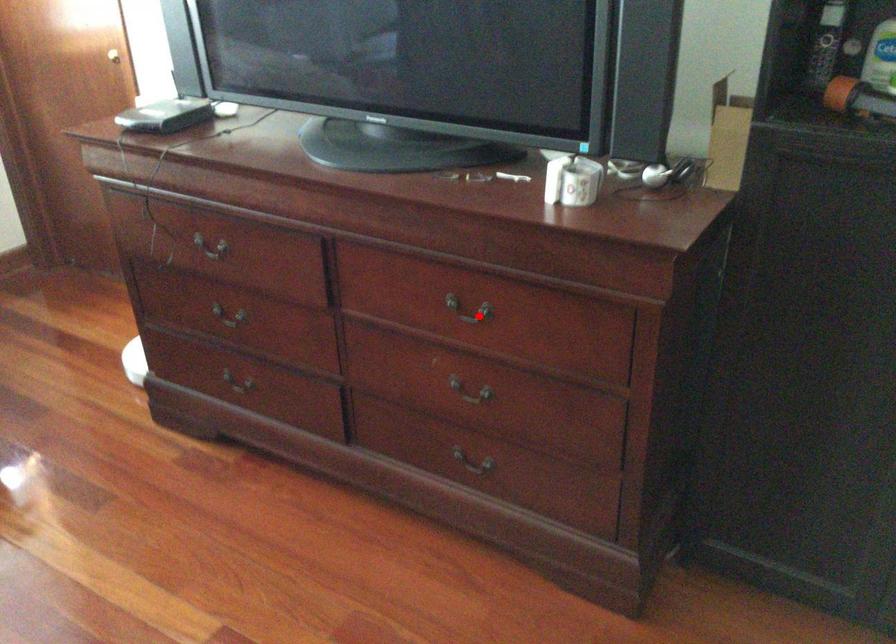
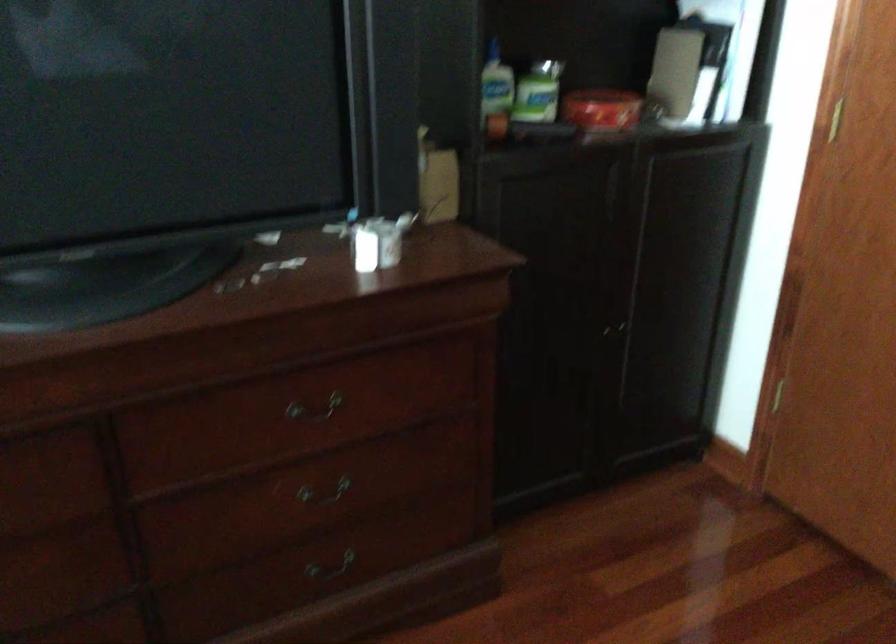
Locate, in the second image, the point that corresponds to the highlighted location in the first image.

(314, 409)